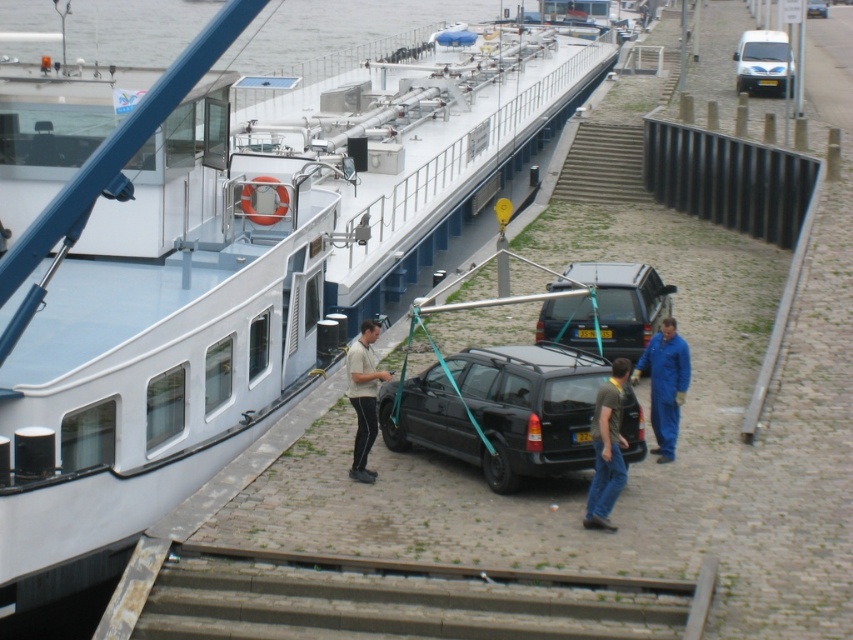
Is point (173, 445) farther from camera compared to point (364, 321)?

Yes, point (173, 445) is farther from viewer.

In the scene shown: Measure the distance between point (x=76, y=460) and camera.

Point (x=76, y=460) and camera are 17.19 meters apart from each other.

Where is `white glossy boat at upper left`? The image size is (853, 640). white glossy boat at upper left is located at coordinates (219, 262).

Which is behind, point (601, 420) or point (753, 58)?

The point (753, 58) is more distant.

What do you see at coordinates (606, 449) in the screenshot? This screenshot has height=640, width=853. I see `dark gray cotton t-shirt at center` at bounding box center [606, 449].

You are a GUI agent. You are given a task and a screenshot of the screen. Output one action in this format:
    pyautogui.click(x=<x>, y=<y>)
    Task: Click on the dark gray cotton t-shirt at center
    
    Given the screenshot: What is the action you would take?
    pyautogui.click(x=606, y=449)

Find the location of `dark gray cotton t-shirt at center`. dark gray cotton t-shirt at center is located at coordinates (606, 449).

Who is positioned more to the left, white glossy boat at upper left or dark gray cotton t-shirt at center?

From the viewer's perspective, white glossy boat at upper left appears more on the left side.

Does point (416, 116) come in front of point (596, 525)?

No.

Identify the location of white glossy boat at upper left. This screenshot has width=853, height=640. (219, 262).